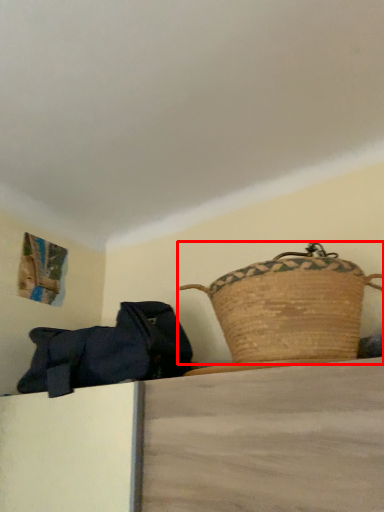
Question: In this image, where is picnic basket (annotated by the red box) located relative to handbag?

Choices:
 (A) left
 (B) right

Answer: (B)